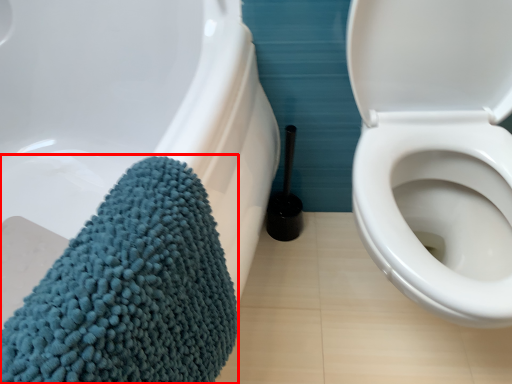
Question: From the image's perspective, where is bath towel (annotated by the red box) located relative to brush?

Choices:
 (A) below
 (B) above

Answer: (A)